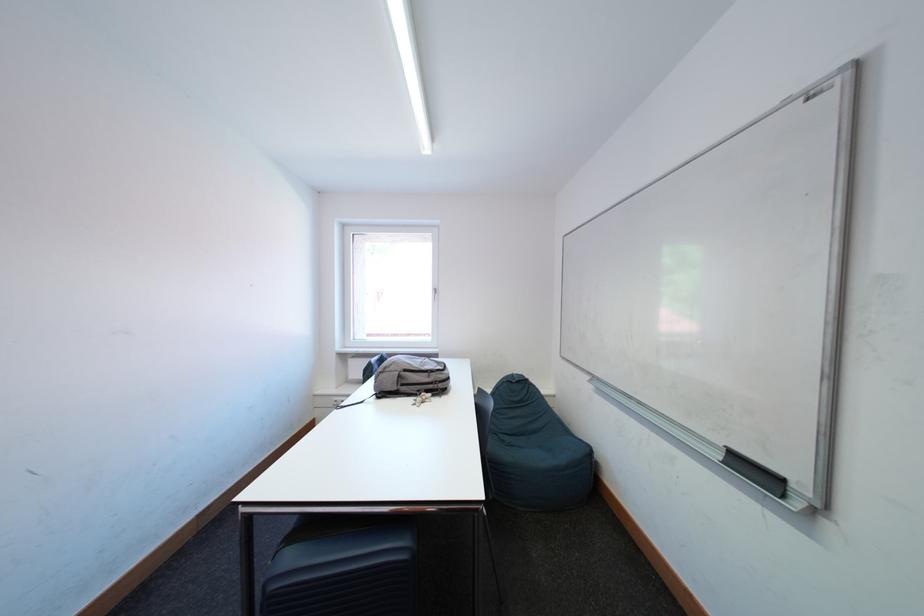
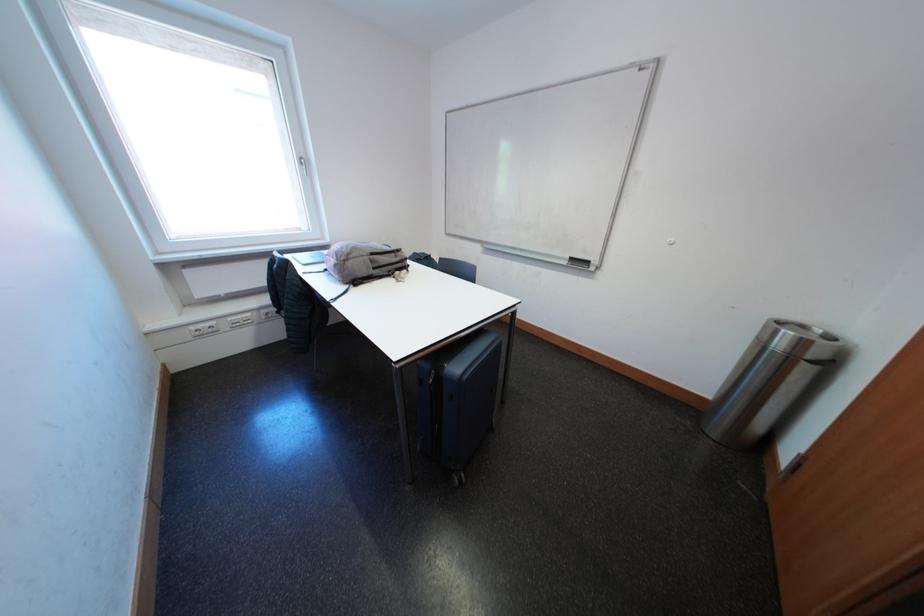
The point at (438, 379) is marked in the first image. Where is the corresponding point in the second image?

(406, 261)